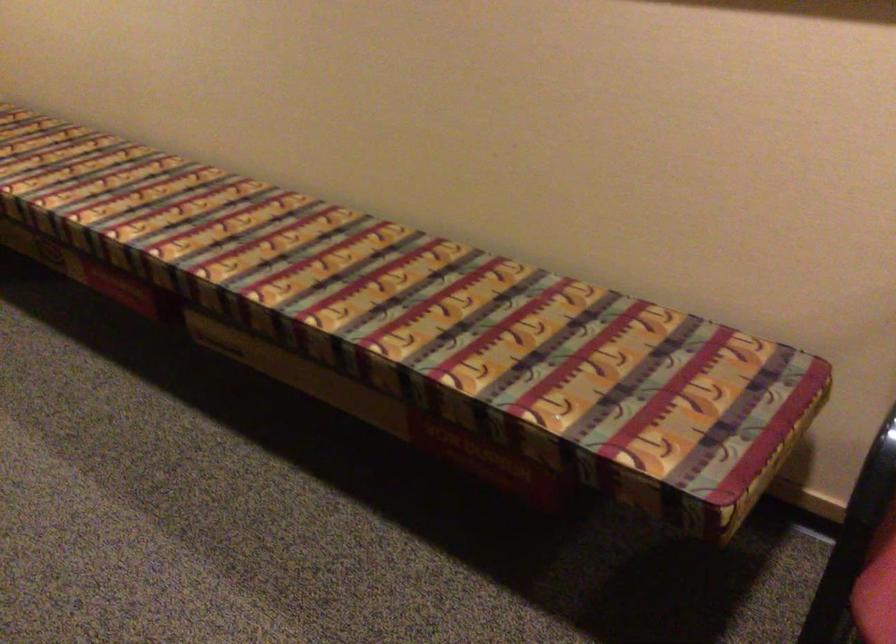
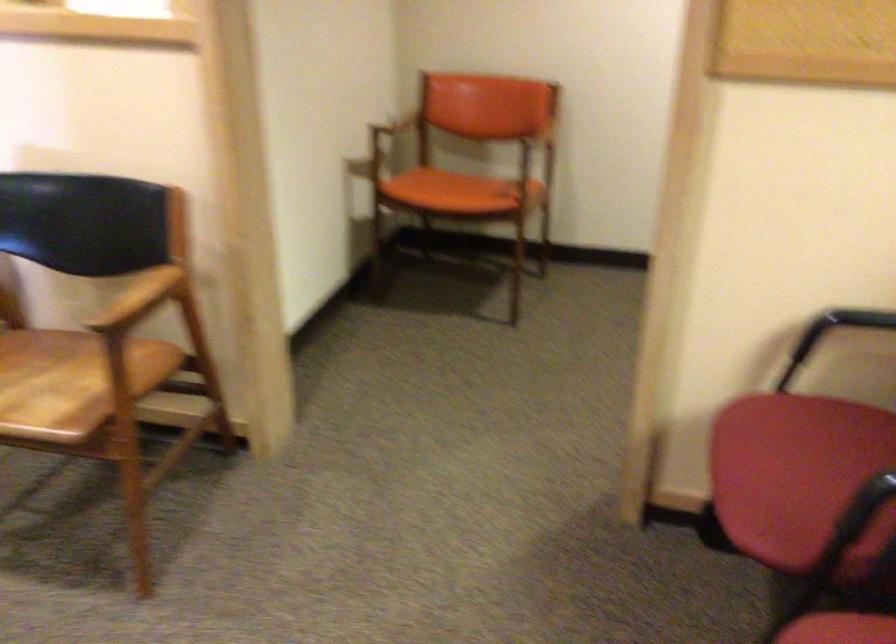
The images are taken continuously from a first-person perspective. In which direction is your viewpoint rotating?

The camera's rotation is toward right-down.